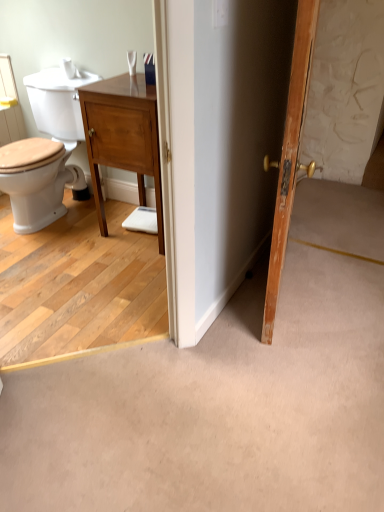
Question: Could you tell me if wooden door at right is turned towards light brown wood vanity at center?

Choices:
 (A) no
 (B) yes

Answer: (A)

Question: From the image's perspective, is wooden door at right beneath light brown wood vanity at center?

Choices:
 (A) yes
 (B) no

Answer: (A)

Question: Is the depth of wooden door at right less than that of light brown wood vanity at center?

Choices:
 (A) no
 (B) yes

Answer: (B)

Question: Considering the relative sizes of wooden door at right and light brown wood vanity at center in the image provided, is wooden door at right wider than light brown wood vanity at center?

Choices:
 (A) no
 (B) yes

Answer: (A)

Question: Considering the relative sizes of wooden door at right and light brown wood vanity at center in the image provided, is wooden door at right thinner than light brown wood vanity at center?

Choices:
 (A) yes
 (B) no

Answer: (A)

Question: Is wooden door at right looking in the opposite direction of light brown wood vanity at center?

Choices:
 (A) no
 (B) yes

Answer: (B)

Question: From a real-world perspective, is light brown wood vanity at center below wooden door at right?

Choices:
 (A) yes
 (B) no

Answer: (A)

Question: Is light brown wood vanity at center turned away from wooden door at right?

Choices:
 (A) no
 (B) yes

Answer: (A)

Question: Does light brown wood vanity at center have a greater height compared to wooden door at right?

Choices:
 (A) yes
 (B) no

Answer: (B)

Question: Can you confirm if light brown wood vanity at center is wider than wooden door at right?

Choices:
 (A) no
 (B) yes

Answer: (B)

Question: Does light brown wood vanity at center lie in front of wooden door at right?

Choices:
 (A) yes
 (B) no

Answer: (B)

Question: Does light brown wood vanity at center touch wooden door at right?

Choices:
 (A) no
 (B) yes

Answer: (A)

Question: Would you say light brown wood vanity at center is inside or outside wooden door at right?

Choices:
 (A) inside
 (B) outside

Answer: (B)